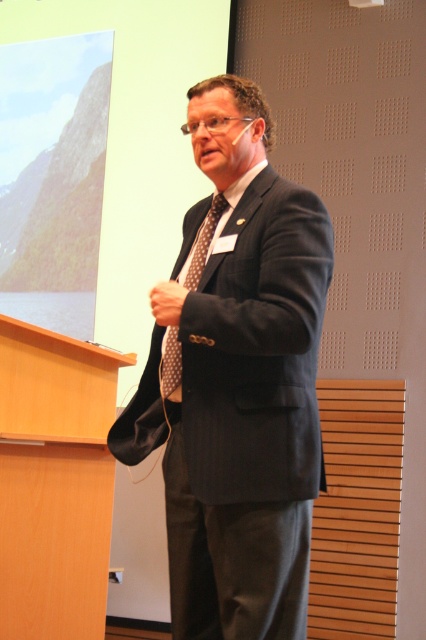
Is matte black suit at center below brown dotted tie at center?

Indeed, matte black suit at center is positioned under brown dotted tie at center.

Locate an element on the screen. matte black suit at center is located at coordinates (236, 380).

Locate an element on the screen. The image size is (426, 640). matte black suit at center is located at coordinates (236, 380).